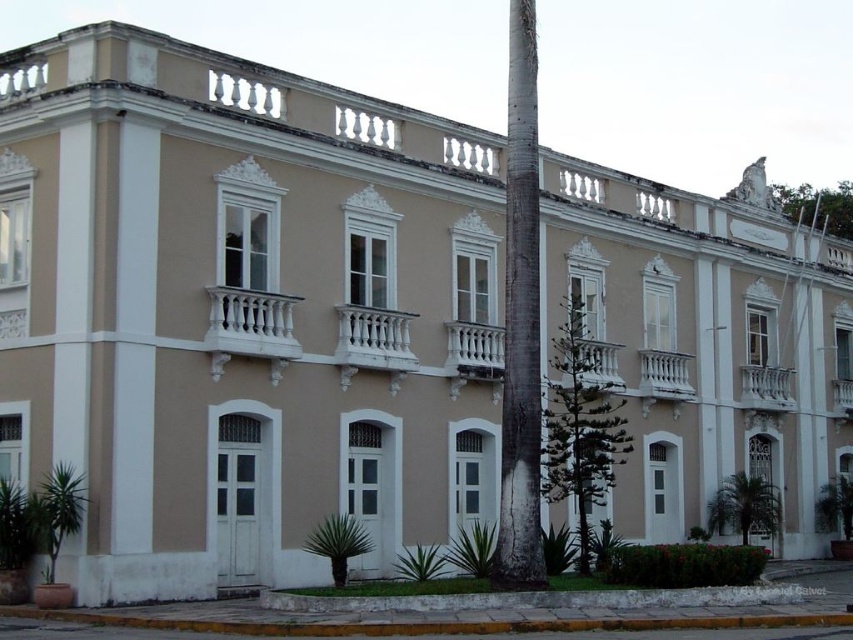
Looking at this image, is green leafy palm tree at lower left positioned at the back of green leafy palm tree at lower center?

That is False.

Can you confirm if green leafy palm tree at lower left is positioned above green leafy palm tree at lower center?

Indeed, green leafy palm tree at lower left is positioned over green leafy palm tree at lower center.

Which is in front, point (82, 499) or point (339, 580)?

Positioned in front is point (82, 499).

You are a GUI agent. You are given a task and a screenshot of the screen. Output one action in this format:
    pyautogui.click(x=<x>, y=<y>)
    Task: Click on the green leafy palm tree at lower left
    
    Given the screenshot: What is the action you would take?
    pyautogui.click(x=57, y=512)

Locate an element on the screen. The width and height of the screenshot is (853, 640). green leafy tree at upper right is located at coordinates (817, 205).

Looking at this image, is green leafy tree at upper right to the right of green leafy palm tree at lower center from the viewer's perspective?

Correct, you'll find green leafy tree at upper right to the right of green leafy palm tree at lower center.

Is point (819, 198) farther from camera compared to point (316, 547)?

Yes, point (819, 198) is farther from viewer.

Find the location of a particular element. green leafy tree at upper right is located at coordinates click(817, 205).

Can you confirm if smooth gray bark at center is bigger than green leafy palm tree at lower center?

Indeed, smooth gray bark at center has a larger size compared to green leafy palm tree at lower center.

Which is below, smooth gray bark at center or green leafy palm tree at lower center?

green leafy palm tree at lower center

The image size is (853, 640). What do you see at coordinates (520, 323) in the screenshot?
I see `smooth gray bark at center` at bounding box center [520, 323].

Find the location of a particular element. The height and width of the screenshot is (640, 853). smooth gray bark at center is located at coordinates (520, 323).